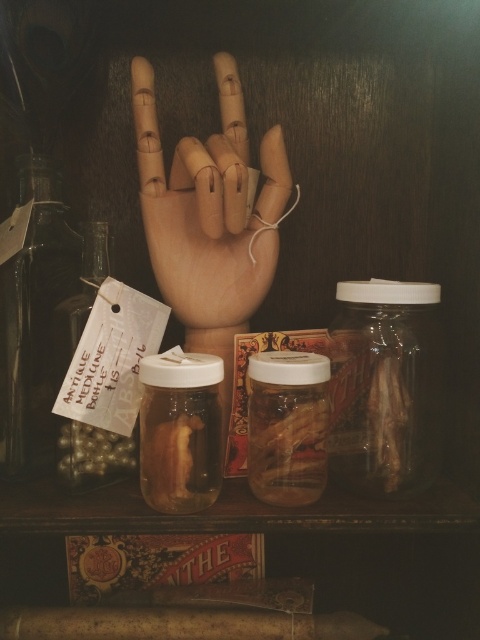
Question: Which object is positioned farthest from the shiny metallic beans at center left?

Choices:
 (A) translucent glass jar at right
 (B) translucent plastic jar at center
 (C) transparent glass bottle at left

Answer: (A)

Question: Can you confirm if wooden hand at center is positioned to the right of translucent plastic jar at center?

Choices:
 (A) no
 (B) yes

Answer: (B)

Question: In this image, where is translucent glass jar at right located relative to shiny metallic beans at center left?

Choices:
 (A) left
 (B) right

Answer: (B)

Question: Is translucent glass jar at right to the left of shiny metallic beans at center left from the viewer's perspective?

Choices:
 (A) yes
 (B) no

Answer: (B)

Question: Estimate the real-world distances between objects in this image. Which object is closer to the translucent plastic jar at center?

Choices:
 (A) wooden hand at center
 (B) shiny metallic beans at center left
 (C) translucent glass jar at right
 (D) translucent glass jar at center

Answer: (D)

Question: Among these points, which one is nearest to the camera?

Choices:
 (A) (129, 472)
 (B) (58, 300)
 (C) (385, 484)
 (D) (152, 493)

Answer: (D)